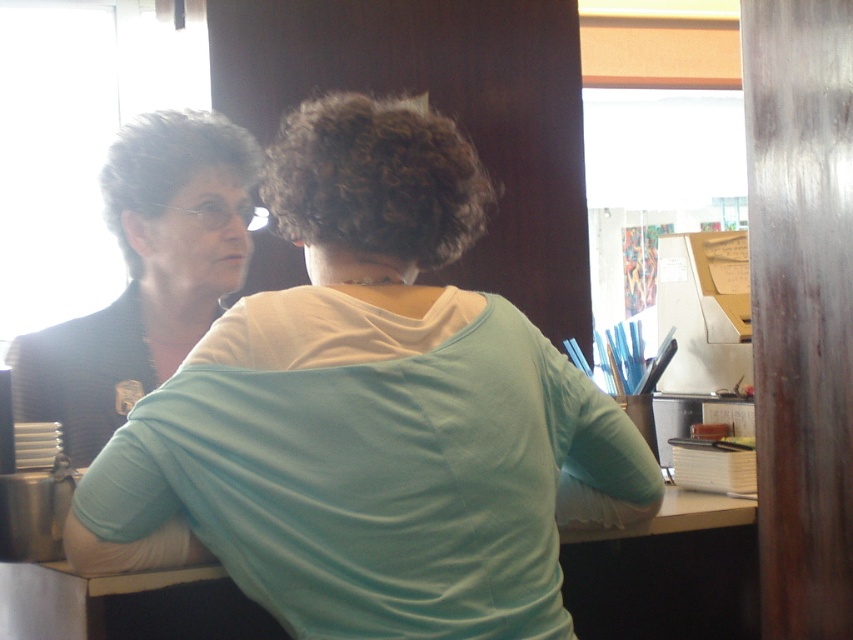
Question: Which of the following is the closest to the observer?

Choices:
 (A) (292, 177)
 (B) (160, 250)

Answer: (A)

Question: Considering the relative positions of matte white shirt at upper left and matte black jacket at left in the image provided, where is matte white shirt at upper left located with respect to matte black jacket at left?

Choices:
 (A) right
 (B) left

Answer: (A)

Question: Is matte white shirt at upper left bigger than matte black jacket at left?

Choices:
 (A) no
 (B) yes

Answer: (B)

Question: Is matte white shirt at upper left to the right of matte black jacket at left from the viewer's perspective?

Choices:
 (A) no
 (B) yes

Answer: (B)